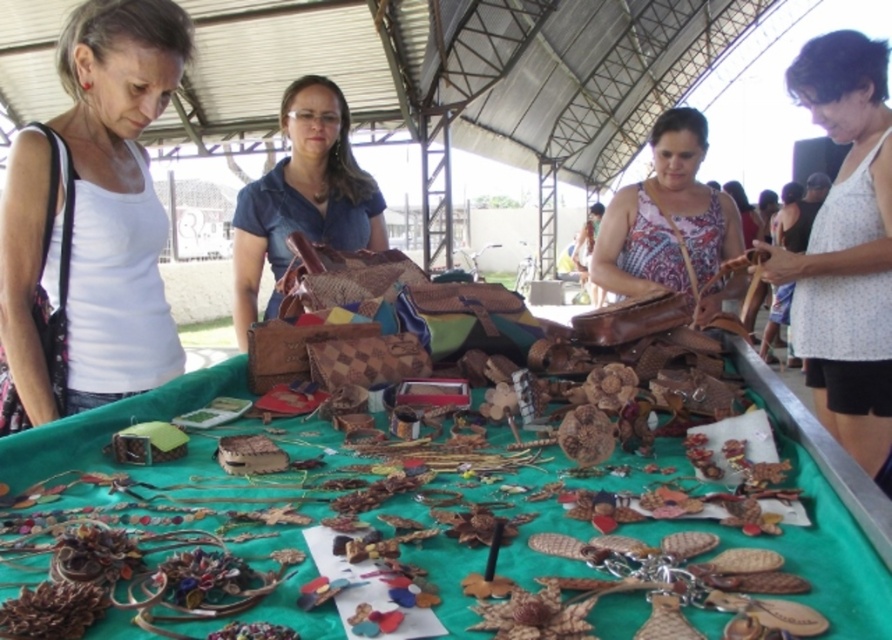
Does white dotted tank top at right appear under patterned fabric purse at center?

Result: Yes.

Is white dotted tank top at right bigger than patterned fabric purse at center?

Incorrect, white dotted tank top at right is not larger than patterned fabric purse at center.

Identify the location of white dotted tank top at right. (847, 246).

The width and height of the screenshot is (892, 640). Find the location of `white dotted tank top at right`. white dotted tank top at right is located at coordinates coord(847,246).

How much distance is there between green fabric at center and matte brown leather purse at center?

green fabric at center is 1.12 meters away from matte brown leather purse at center.

This screenshot has width=892, height=640. What do you see at coordinates (816, 556) in the screenshot?
I see `green fabric at center` at bounding box center [816, 556].

Which is in front, point (14, 486) or point (269, 211)?

Positioned in front is point (14, 486).

At what (x,y) coordinates should I click in order to perform the action: click on green fabric at center. Please return your answer as a coordinate pair (x, y). Looking at the image, I should click on (816, 556).

Based on the photo, does white dotted tank top at right appear under matte brown leather purse at center?

Correct, white dotted tank top at right is located below matte brown leather purse at center.

From the picture: Can you confirm if white dotted tank top at right is taller than matte brown leather purse at center?

Indeed, white dotted tank top at right has a greater height compared to matte brown leather purse at center.

Is point (890, 429) positioned before point (303, 177)?

Yes, point (890, 429) is in front of point (303, 177).

Find the location of a particular element. white dotted tank top at right is located at coordinates (847, 246).